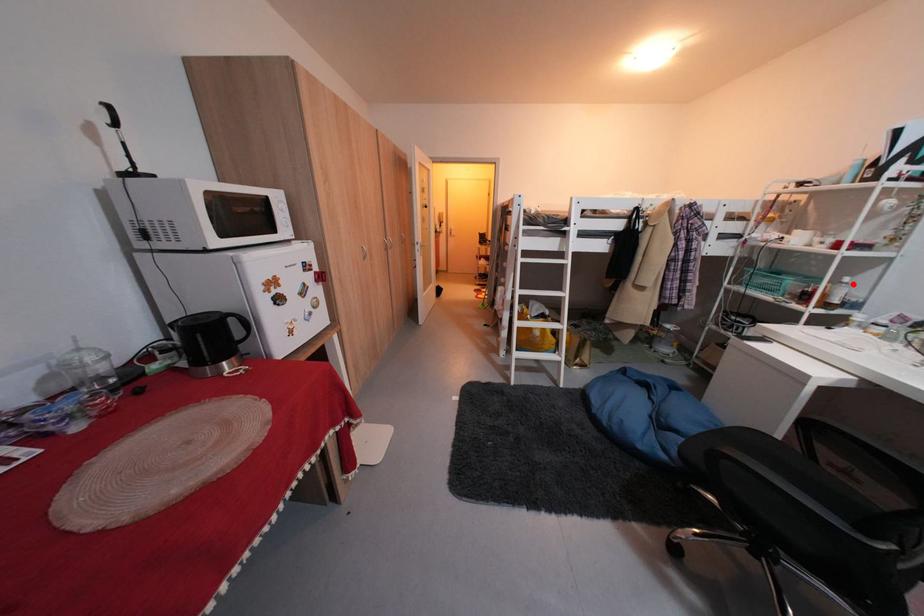
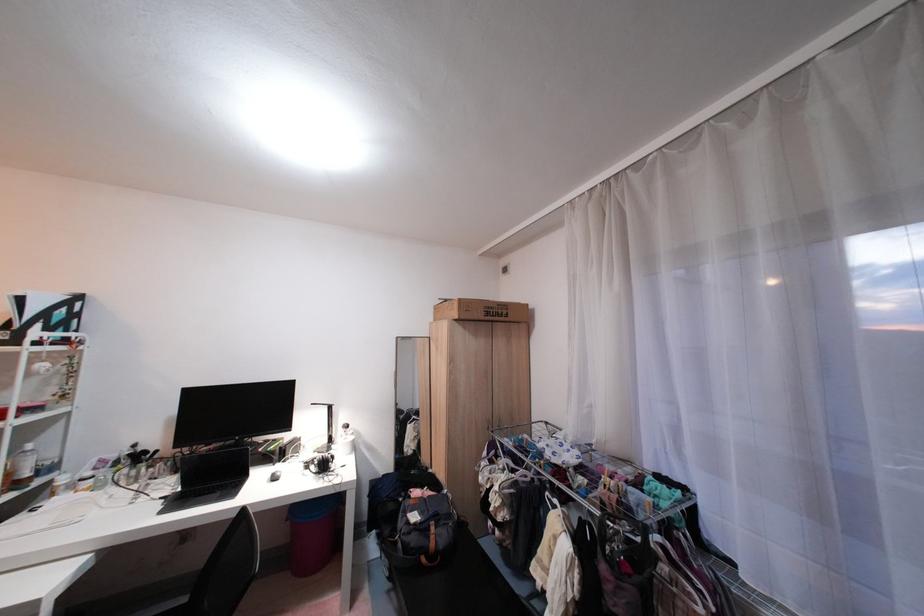
Locate, in the second image, the point that corresponds to the highlighted location in the first image.

(35, 453)